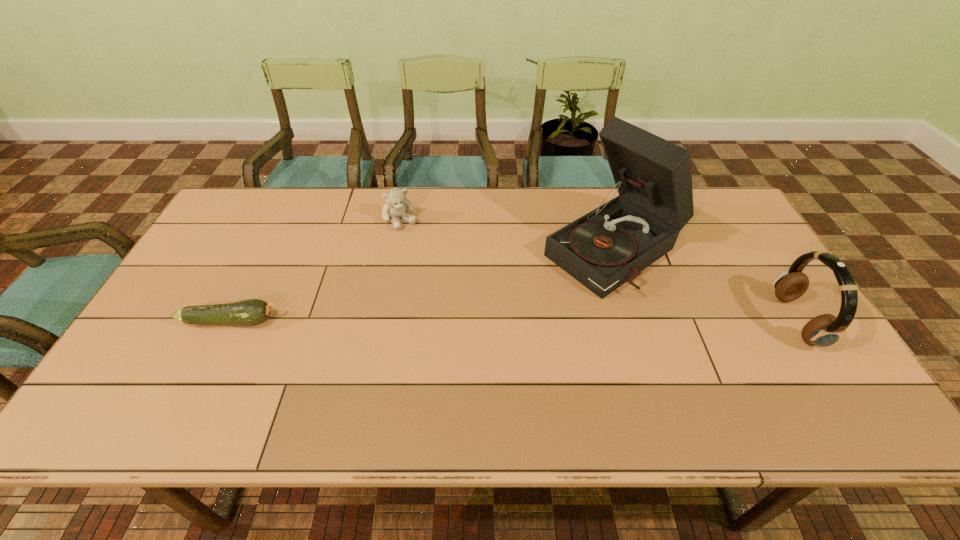
You are a GUI agent. You are given a task and a screenshot of the screen. Output one action in this format:
    pyautogui.click(x=<x>, y=<y>)
    Task: Click on the object situated at the left edge
    The height and width of the screenshot is (540, 960).
    Given the screenshot: What is the action you would take?
    pyautogui.click(x=250, y=312)

Identify the location of object located in the right edge section of the desktop. (824, 330).

The width and height of the screenshot is (960, 540). Identify the location of vacant region at the far edge of the desktop. (561, 211).

Where is `vacant space at the near edge of the desktop`? The height and width of the screenshot is (540, 960). vacant space at the near edge of the desktop is located at coordinates (764, 368).

Where is `vacant space at the left edge of the desktop`? This screenshot has height=540, width=960. vacant space at the left edge of the desktop is located at coordinates (133, 356).

This screenshot has width=960, height=540. I want to click on blank area at the right edge, so pyautogui.click(x=749, y=233).

Where is `vacant space that is in between the second object from left to right and the third object from left to right`? The height and width of the screenshot is (540, 960). vacant space that is in between the second object from left to right and the third object from left to right is located at coordinates (508, 235).

Locate an element on the screen. empty space between the leftmost object and the headset is located at coordinates (514, 321).

Identify the location of free point between the phonograph_record and the second shortest object. This screenshot has height=540, width=960. (508, 235).

Locate an element on the screen. vacant space that is in between the teddy bear and the phonograph_record is located at coordinates (508, 235).